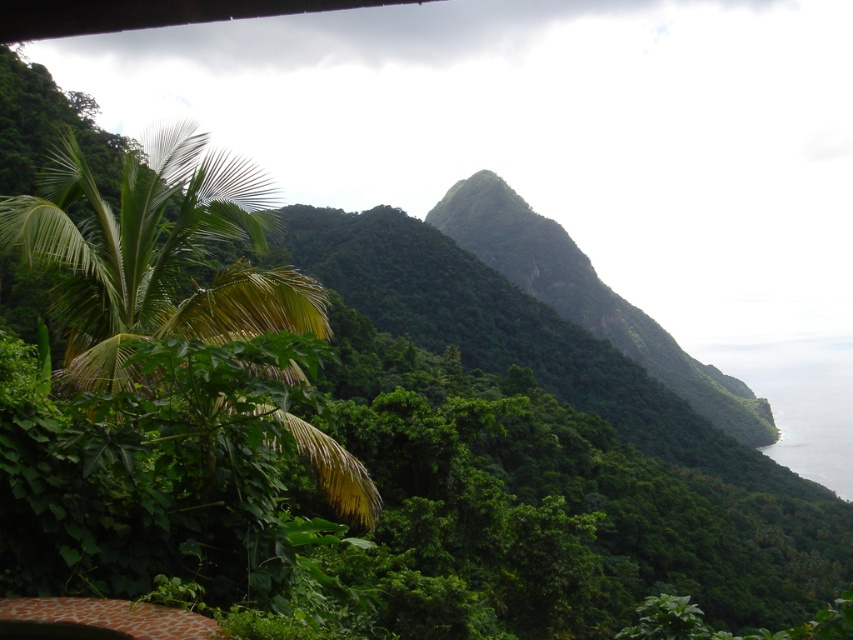
Question: Can you confirm if green leafy hill at center is bigger than clear water at lower right?

Choices:
 (A) no
 (B) yes

Answer: (B)

Question: Is green leafy hill at center thinner than clear water at lower right?

Choices:
 (A) no
 (B) yes

Answer: (A)

Question: Is green leafy hill at center above clear water at lower right?

Choices:
 (A) yes
 (B) no

Answer: (A)

Question: Which of the following is the closest to the observer?

Choices:
 (A) (782, 406)
 (B) (543, 260)

Answer: (B)

Question: Which point is closer to the camera?

Choices:
 (A) clear water at lower right
 (B) green leafy hill at center

Answer: (B)

Question: Among these points, which one is farthest from the camera?

Choices:
 (A) (828, 401)
 (B) (521, 211)

Answer: (A)